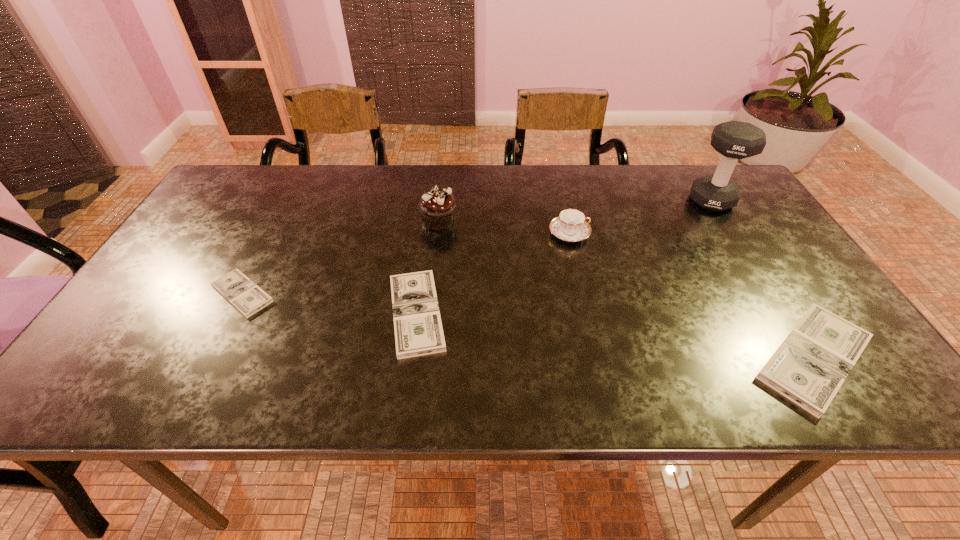
If equal spacing is the goal by inserting an additional dollar among them, please point out a vacant space for this new dollar. Please provide its 2D coordinates. Your answer should be formatted as a tuple, i.e. [(x, y)], where the tuple contains the x and y coordinates of a point satisfying the conditions above.

[(607, 335)]